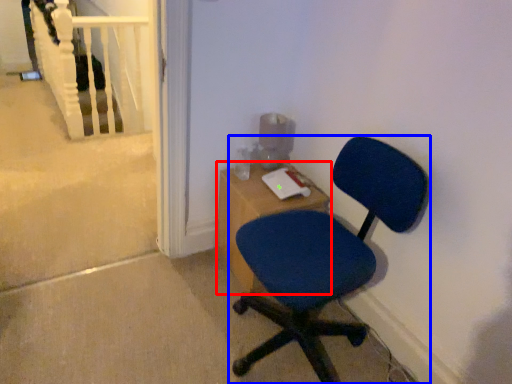
Question: Which of the following is the closest to the observer, desk (highlighted by a red box) or chair (highlighted by a blue box)?

Choices:
 (A) desk
 (B) chair

Answer: (B)